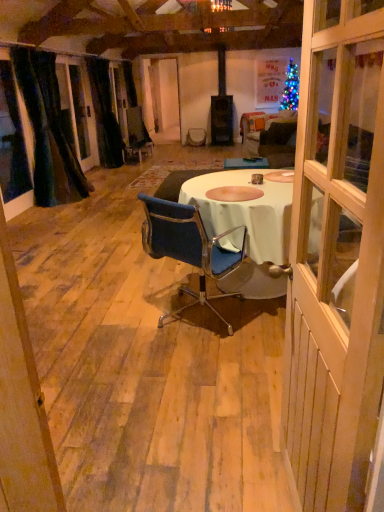
Identify the location of vacant area situated below blue fabric chair at center (from a real-world perspective). (202, 317).